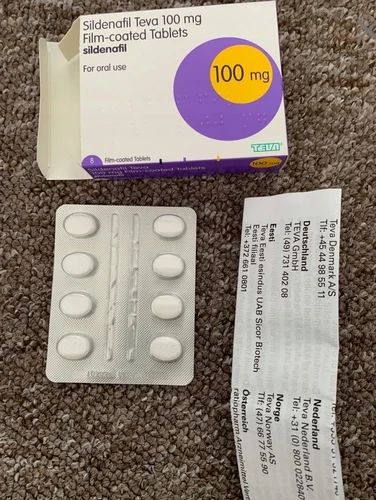
This screenshot has width=376, height=500. I want to click on carpet, so click(x=53, y=431).